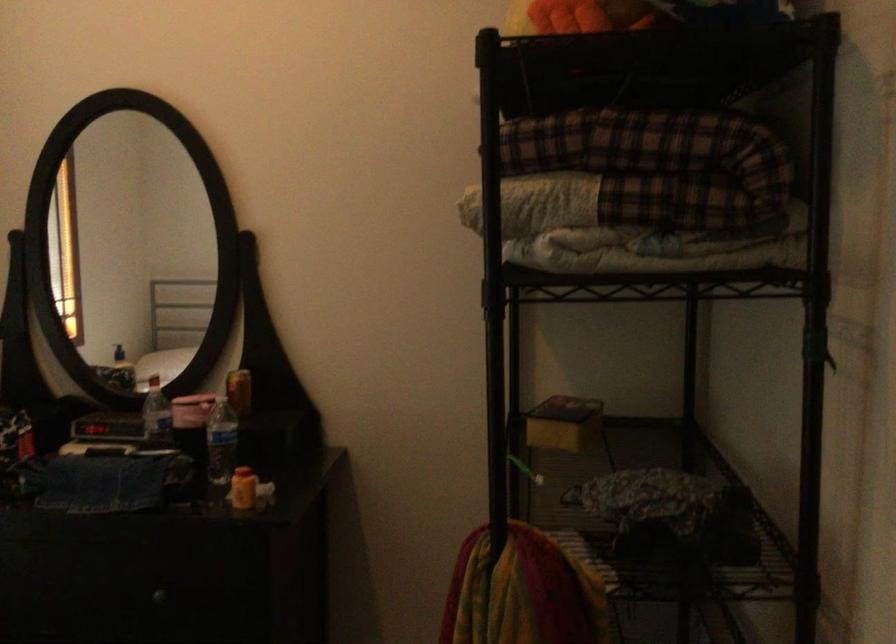
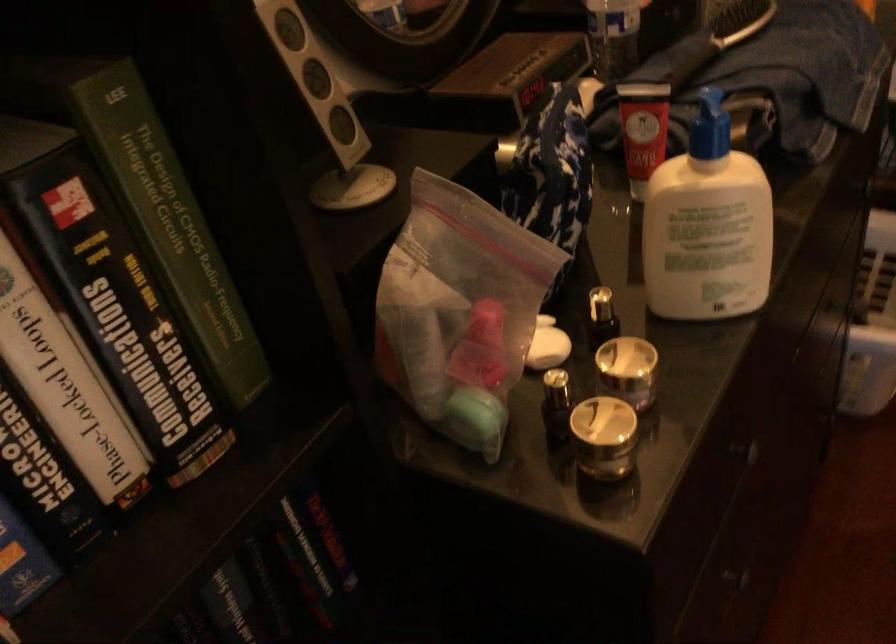
Find the pixel in the second image that matches (x=91, y=415) in the first image.

(506, 80)